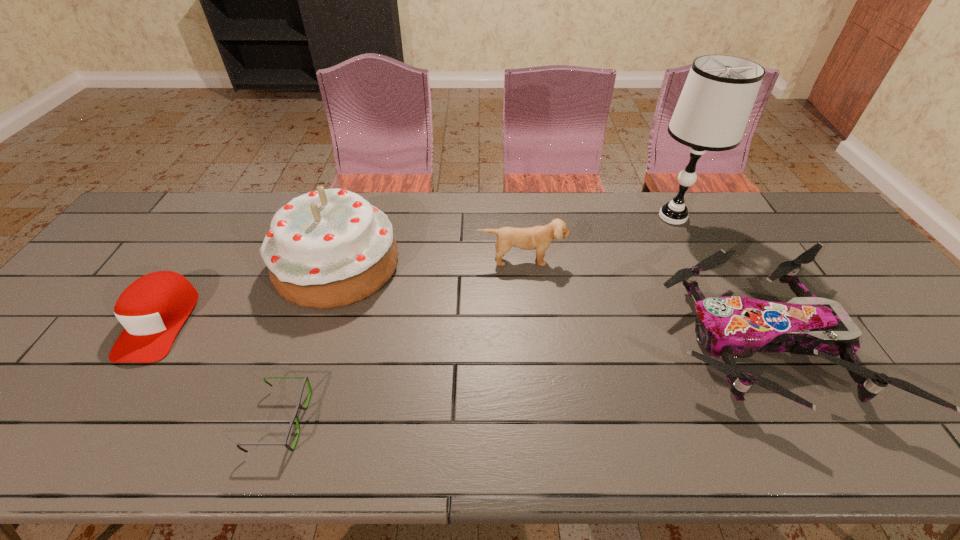
The height and width of the screenshot is (540, 960). Find the location of `free point between the shortest object and the fourth object from left to right`. free point between the shortest object and the fourth object from left to right is located at coordinates click(x=401, y=340).

This screenshot has width=960, height=540. Identify the location of free point between the second tallest object and the third object from right to left. (430, 262).

Choose which object is the second nearest neighbor to the baseball cap. Please provide its 2D coordinates. Your answer should be formatted as a tuple, i.e. [(x, y)], where the tuple contains the x and y coordinates of a point satisfying the conditions above.

[(298, 406)]

Identify which object is located as the fourth nearest to the spectacles. Please provide its 2D coordinates. Your answer should be formatted as a tuple, i.e. [(x, y)], where the tuple contains the x and y coordinates of a point satisfying the conditions above.

[(731, 327)]

Locate an element on the screen. free space that satisfies the following two spatial constraints: 1. on the front side of the fifth shortest object; 2. on the lens of the spectacles is located at coordinates (286, 420).